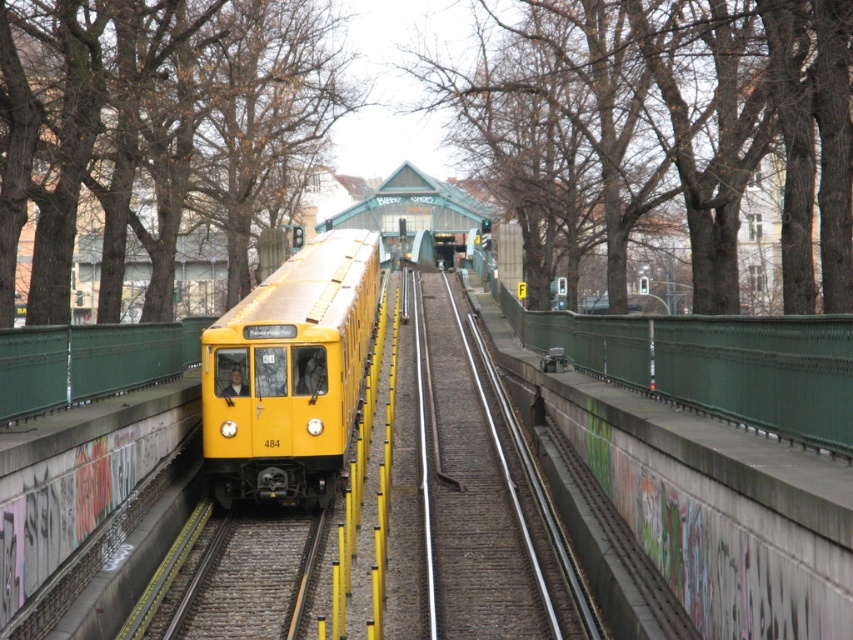
In the scene shown: You are standing at the subway station entrance and see the bare branches at upper center and the brown leafless tree at left. Which object is positioned to the right of the other?

The bare branches at upper center are positioned to the right of the brown leafless tree at left.

You are standing at the station entrance and see two points marked on the ground ahead of you. The first point is at coordinates point [813,17] and the second point is at point [234,381]. Which point is closer to you?

Point [813,17] is in front of point [234,381], so it is closer to you.

You are an observer standing on the platform of the subway station. You notice the bare branches at upper center and the yellow matte train at center. Which object appears wider in the image?

The bare branches at upper center appears wider than the yellow matte train at center because its width is larger according to the description.